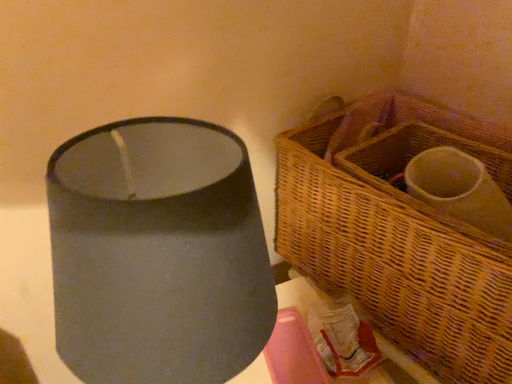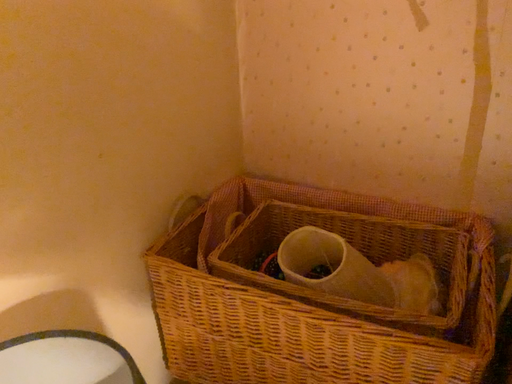
Question: Which way did the camera rotate in the video?

Choices:
 (A) rotated upward
 (B) rotated downward

Answer: (A)